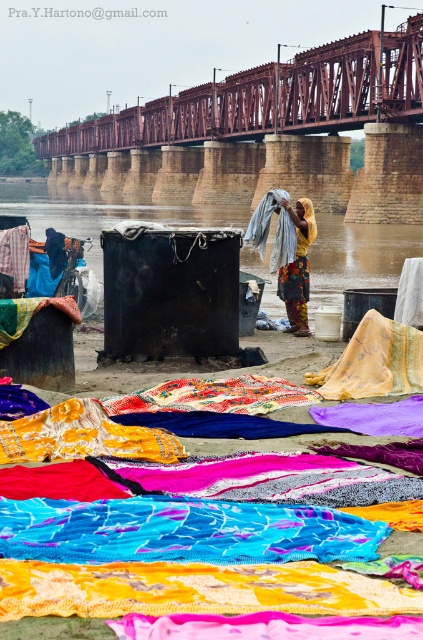
You are a traveler who just arrived at the riverside. You need to cross the river to reach the village on the other side. The rusty metal bridge at upper center and the brown concrete river at center are in your view. Which direction should you head towards to find the bridge?

The rusty metal bridge at upper center is positioned on the left side of the brown concrete river at center, so you should head towards the left side of the brown concrete river at center to find the bridge.

You are standing at the riverside and want to take a photo of the laundry scene. The camera you have can only focus on objects within 100 meters. Is the point at coordinates point (375,65) within the camera focus range?

The distance of point (375,65) from camera is 102.90 meters, which is beyond the camera focus range of 100 meters. Therefore, the point is out of focus.